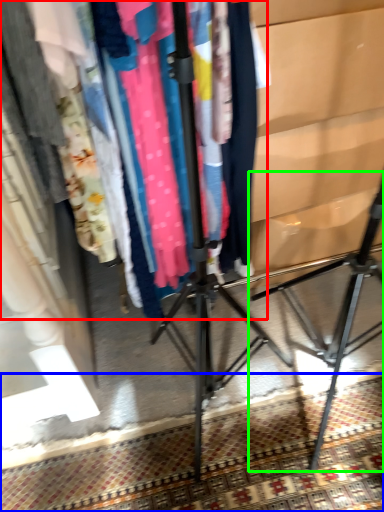
Question: Which is farther away from closet (highlighted by a red box)? mat (highlighted by a blue box) or tripod (highlighted by a green box)?

Choices:
 (A) mat
 (B) tripod

Answer: (B)